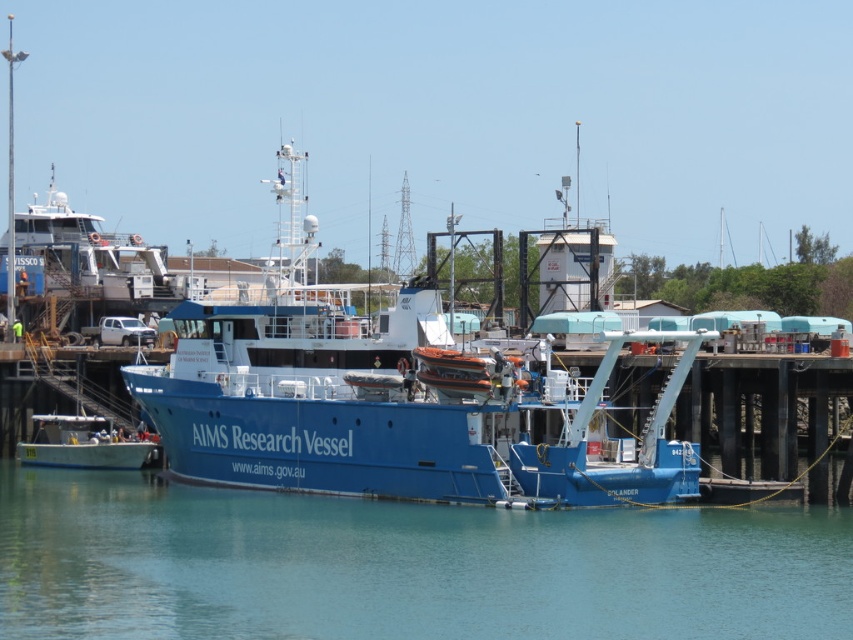
The height and width of the screenshot is (640, 853). In order to click on clear blue water at center in this screenshot , I will do `click(402, 564)`.

Is point (349, 540) in front of point (148, 449)?

Yes.

Find the location of a particular element. The width and height of the screenshot is (853, 640). clear blue water at center is located at coordinates (402, 564).

Who is more forward, (537, 376) or (120, 452)?

Point (537, 376) is in front.

Does blue matte research vessel at center have a smaller size compared to blue matte boat at lower left?

No, blue matte research vessel at center is not smaller than blue matte boat at lower left.

The width and height of the screenshot is (853, 640). What do you see at coordinates (395, 408) in the screenshot?
I see `blue matte research vessel at center` at bounding box center [395, 408].

At what (x,y) coordinates should I click in order to perform the action: click on blue matte research vessel at center. Please return your answer as a coordinate pair (x, y). Looking at the image, I should click on (395, 408).

Can you confirm if clear blue water at center is positioned to the left of blue matte research vessel at center?

Indeed, clear blue water at center is positioned on the left side of blue matte research vessel at center.

I want to click on clear blue water at center, so click(x=402, y=564).

At what (x,y) coordinates should I click in order to perform the action: click on clear blue water at center. Please return your answer as a coordinate pair (x, y). Looking at the image, I should click on (402, 564).